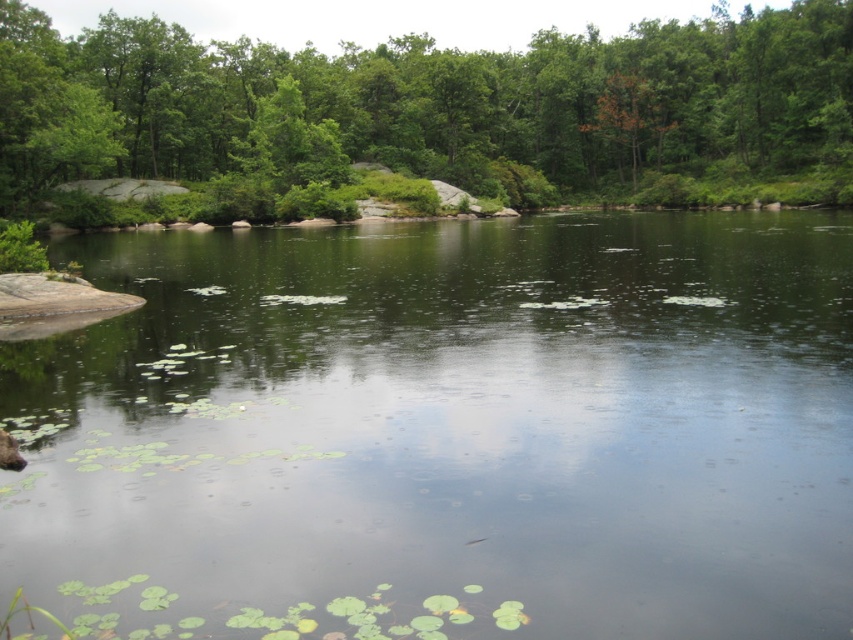
You are standing on a path near the water and want to take a photo of the green leafy tree at center and the green smooth water at center. Which object should you focus on first if you want to capture both in the same frame?

The green smooth water at center is below green leafy tree at center, so you should focus on the green leafy tree at center first to ensure both are in the frame.